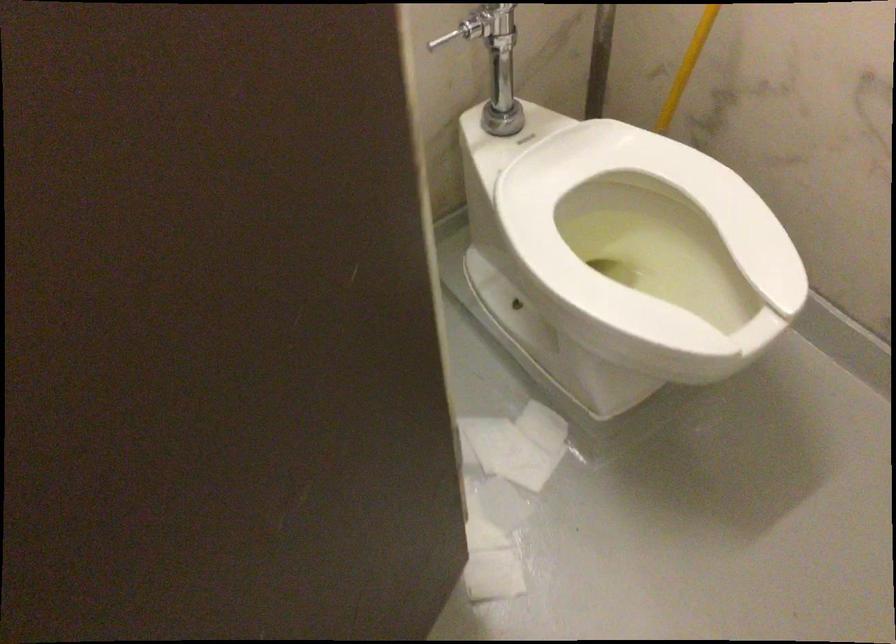
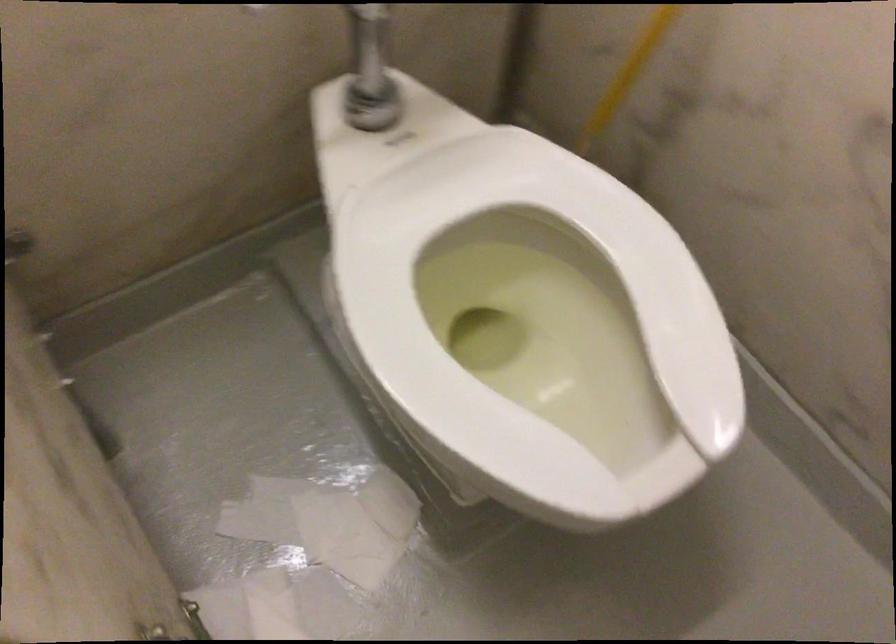
Question: The first image is from the beginning of the video and the second image is from the end. How did the camera likely rotate when shooting the video?

Choices:
 (A) Left
 (B) Right
 (C) Up
 (D) Down

Answer: (D)